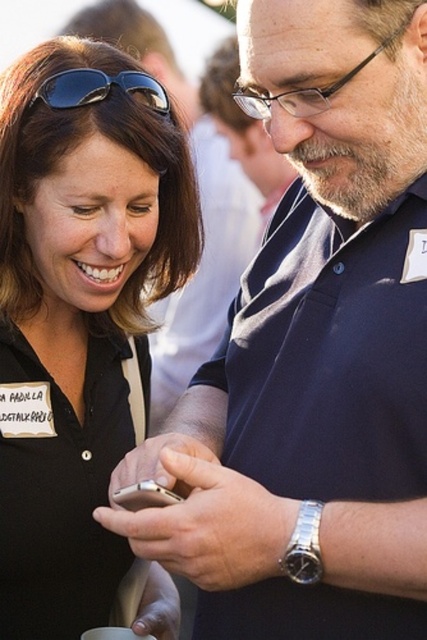
You are a photographer standing in front of the two people in the image. You need to take a photo that includes both the matte black shirt at center and the black matte sunglasses at upper left. Based on their sizes in the image, which object should you focus on first to ensure both are in frame?

The matte black shirt at center is much taller than the black matte sunglasses at upper left, so you should focus on including the matte black shirt at center first to ensure both fit in the frame.

Based on the scene described, which object is wider when comparing the matte black shirt at center and the black matte sunglasses at upper left?

The matte black shirt at center is wider than the black matte sunglasses at upper left.

You are a photographer standing in front of the two people in the scene. You want to take a photo of the silver metallic smartphone at center without including the matte black shirt at center in the frame. Is this possible based on their positions?

The matte black shirt at center is further to the viewer than the silver metallic smartphone at center, so the smartphone is behind the shirt. Therefore, it would be challenging to capture the smartphone without including the shirt in the frame unless you move your position or angle.